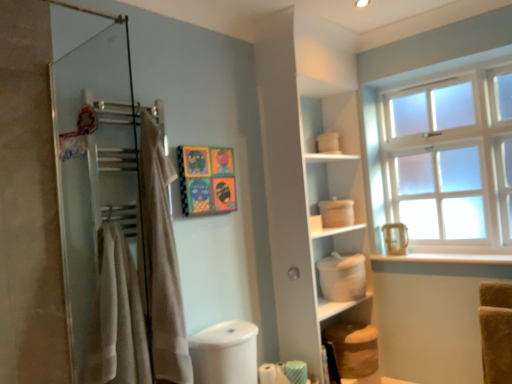
Describe the element at coordinates (447, 258) in the screenshot. I see `white matte window sill at lower right` at that location.

I want to click on beige fabric towel at left, so click(160, 261).

What do you see at coordinates (280, 375) in the screenshot? Image resolution: width=512 pixels, height=384 pixels. I see `white matte toilet paper at lower center, the 1th toilet paper in the left-to-right sequence` at bounding box center [280, 375].

The width and height of the screenshot is (512, 384). Describe the element at coordinates (206, 180) in the screenshot. I see `vibrant paper collage at center` at that location.

Measure the distance between satin white window at upper right and camera.

satin white window at upper right is 7.97 feet from camera.

What do you see at coordinates (117, 316) in the screenshot? The width and height of the screenshot is (512, 384). I see `beige cotton bath towel at left` at bounding box center [117, 316].

Identify the location of green striped toilet paper at lower center, the 1th toilet paper from the right. The image size is (512, 384). (296, 371).

The image size is (512, 384). What are the coordinates of `white matte window sill at lower right` in the screenshot? It's located at (447, 258).

Which is less distant, (283, 377) or (442, 255)?

Point (283, 377) appears to be closer to the viewer than point (442, 255).

Is white matte toilet paper at lower center, arranged as the second toilet paper when viewed from the right, taller or shorter than white matte window sill at lower right?

In the image, white matte toilet paper at lower center, arranged as the second toilet paper when viewed from the right, appears to be taller than white matte window sill at lower right.

Is white matte toilet paper at lower center, the 1th toilet paper in the left-to-right sequence, far away from white matte window sill at lower right?

Indeed, white matte toilet paper at lower center, the 1th toilet paper in the left-to-right sequence, is not near white matte window sill at lower right.

How many degrees apart are the facing directions of white matte toilet paper at lower center, arranged as the second toilet paper when viewed from the right, and white matte window sill at lower right?

The facing directions of white matte toilet paper at lower center, arranged as the second toilet paper when viewed from the right, and white matte window sill at lower right are 89.3 degrees apart.

Could you tell me if white matte window sill at lower right is turned towards vibrant paper collage at center?

No, white matte window sill at lower right is not turned towards vibrant paper collage at center.

Locate an element on the screen. The height and width of the screenshot is (384, 512). art located above the white matte window sill at lower right (from the image's perspective) is located at coordinates (206, 180).

Looking at this image, from the image's perspective, is white matte window sill at lower right under vibrant paper collage at center?

Yes, from the image's perspective, white matte window sill at lower right is below vibrant paper collage at center.

Between white matte window sill at lower right and vibrant paper collage at center, which one has larger width?

white matte window sill at lower right.

From a real-world perspective, is white matte toilet paper at lower center, arranged as the second toilet paper when viewed from the right, beneath white matte cabinet at center?

Correct, in the physical world, white matte toilet paper at lower center, arranged as the second toilet paper when viewed from the right, is lower than white matte cabinet at center.

Between white matte toilet paper at lower center, the 1th toilet paper in the left-to-right sequence, and white matte cabinet at center, which one has smaller size?

Smaller between the two is white matte toilet paper at lower center, the 1th toilet paper in the left-to-right sequence.

What's the angular difference between white matte toilet paper at lower center, the 1th toilet paper in the left-to-right sequence, and white matte cabinet at center's facing directions?

The facing directions of white matte toilet paper at lower center, the 1th toilet paper in the left-to-right sequence, and white matte cabinet at center are 0.365 degrees apart.

Which object is positioned more to the left, white matte toilet paper at lower center, arranged as the second toilet paper when viewed from the right, or white matte cabinet at center?

white matte toilet paper at lower center, arranged as the second toilet paper when viewed from the right.

The width and height of the screenshot is (512, 384). I want to click on shower curtain positioned vertically above the beige cotton bath towel at left (from a real-world perspective), so (160, 261).

Would you say beige fabric towel at left contains beige cotton bath towel at left?

Actually, beige cotton bath towel at left is outside beige fabric towel at left.

What's the angular difference between beige fabric towel at left and beige cotton bath towel at left's facing directions?

The angle between the facing direction of beige fabric towel at left and the facing direction of beige cotton bath towel at left is 0.699 degrees.

Looking at this image, is beige fabric towel at left placed right next to beige cotton bath towel at left?

beige fabric towel at left and beige cotton bath towel at left are clearly separated.

Is vibrant paper collage at center far from white matte window sill at lower right?

Yes, vibrant paper collage at center is far from white matte window sill at lower right.

Is point (216, 201) positioned in front of point (474, 256)?

Yes, it is.

From the picture: Is vibrant paper collage at center taller than white matte window sill at lower right?

Yes, vibrant paper collage at center is taller than white matte window sill at lower right.

Between vibrant paper collage at center and white matte window sill at lower right, which one has larger width?

white matte window sill at lower right is wider.

Can you confirm if white matte window sill at lower right is positioned to the right of satin white window at upper right?

In fact, white matte window sill at lower right is to the left of satin white window at upper right.

Can you see white matte window sill at lower right touching satin white window at upper right?

No, white matte window sill at lower right is not in contact with satin white window at upper right.

The image size is (512, 384). In order to click on window sill located in front of the satin white window at upper right in this screenshot , I will do (x=447, y=258).

Considering the sizes of objects white matte toilet paper at lower center, the 1th toilet paper in the left-to-right sequence, and vibrant paper collage at center in the image provided, who is smaller, white matte toilet paper at lower center, the 1th toilet paper in the left-to-right sequence, or vibrant paper collage at center?

With smaller size is white matte toilet paper at lower center, the 1th toilet paper in the left-to-right sequence.

Which object is wider, white matte toilet paper at lower center, the 1th toilet paper in the left-to-right sequence, or vibrant paper collage at center?

Wider between the two is white matte toilet paper at lower center, the 1th toilet paper in the left-to-right sequence.

Where is `the 2nd toilet paper directly beneath the vibrant paper collage at center (from a real-world perspective)`? Image resolution: width=512 pixels, height=384 pixels. the 2nd toilet paper directly beneath the vibrant paper collage at center (from a real-world perspective) is located at coordinates (280, 375).

Is white matte toilet paper at lower center, arranged as the second toilet paper when viewed from the right, facing away from vibrant paper collage at center?

white matte toilet paper at lower center, arranged as the second toilet paper when viewed from the right, does not have its back to vibrant paper collage at center.

Identify the location of window sill above the white matte toilet paper at lower center, the 1th toilet paper in the left-to-right sequence (from the image's perspective). This screenshot has height=384, width=512. (447, 258).

Where is `window sill behind the vibrant paper collage at center`? This screenshot has height=384, width=512. window sill behind the vibrant paper collage at center is located at coordinates (447, 258).

Estimate the real-world distances between objects in this image. Which object is closer to vibrant paper collage at center, beige fabric towel at left or satin white window at upper right?

beige fabric towel at left is positioned closer to the anchor vibrant paper collage at center.

Estimate the real-world distances between objects in this image. Which object is further from satin white window at upper right, white matte cabinet at center or vibrant paper collage at center?

vibrant paper collage at center is positioned further to the anchor satin white window at upper right.

Which object lies nearer to the anchor point vibrant paper collage at center, satin white window at upper right or white matte container at center-right?

Among the two, white matte container at center-right is located nearer to vibrant paper collage at center.

Which object lies further to the anchor point white matte toilet paper at lower center, the 1th toilet paper in the left-to-right sequence, vibrant paper collage at center or white matte window sill at lower right?

Based on the image, white matte window sill at lower right appears to be further to white matte toilet paper at lower center, the 1th toilet paper in the left-to-right sequence.

Which object lies nearer to the anchor point white matte window sill at lower right, beige fabric towel at left or beige cotton bath towel at left?

beige fabric towel at left is positioned closer to the anchor white matte window sill at lower right.

Which object lies nearer to the anchor point beige fabric towel at left, satin white window at upper right or white matte container at center-right?

white matte container at center-right is closer to beige fabric towel at left.

Based on the photo, from the image, which object appears to be nearer to white matte toilet paper at lower center, the 1th toilet paper in the left-to-right sequence, vibrant paper collage at center or beige cotton bath towel at left?

Based on the image, beige cotton bath towel at left appears to be nearer to white matte toilet paper at lower center, the 1th toilet paper in the left-to-right sequence.

From the image, which object appears to be nearer to white matte window sill at lower right, white matte container at center-right or white matte toilet paper at lower center, the 1th toilet paper in the left-to-right sequence?

white matte container at center-right lies closer to white matte window sill at lower right than the other object.

Locate an element on the screen. The width and height of the screenshot is (512, 384). shower curtain between beige cotton bath towel at left and satin white window at upper right is located at coordinates (160, 261).

This screenshot has width=512, height=384. I want to click on toilet paper between white matte toilet paper at lower center, the 1th toilet paper in the left-to-right sequence, and white matte window sill at lower right from left to right, so click(296, 371).

The image size is (512, 384). What are the coordinates of `cabinet between white matte toilet paper at lower center, the 1th toilet paper in the left-to-right sequence, and white matte window sill at lower right` in the screenshot? It's located at (330, 198).

Identify the location of window sill between vibrant paper collage at center and satin white window at upper right in the horizontal direction. The image size is (512, 384). (447, 258).